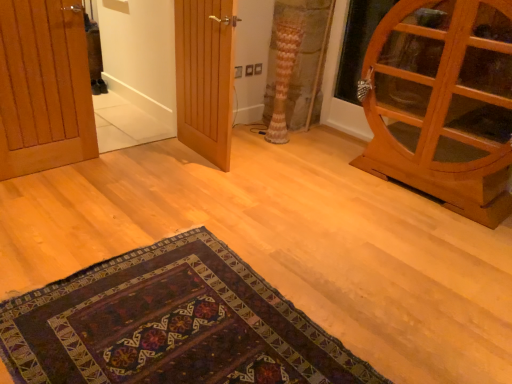
Locate an element on the screen. The width and height of the screenshot is (512, 384). free space in front of wooden door at center, the second door in the right-to-left sequence is located at coordinates (178, 182).